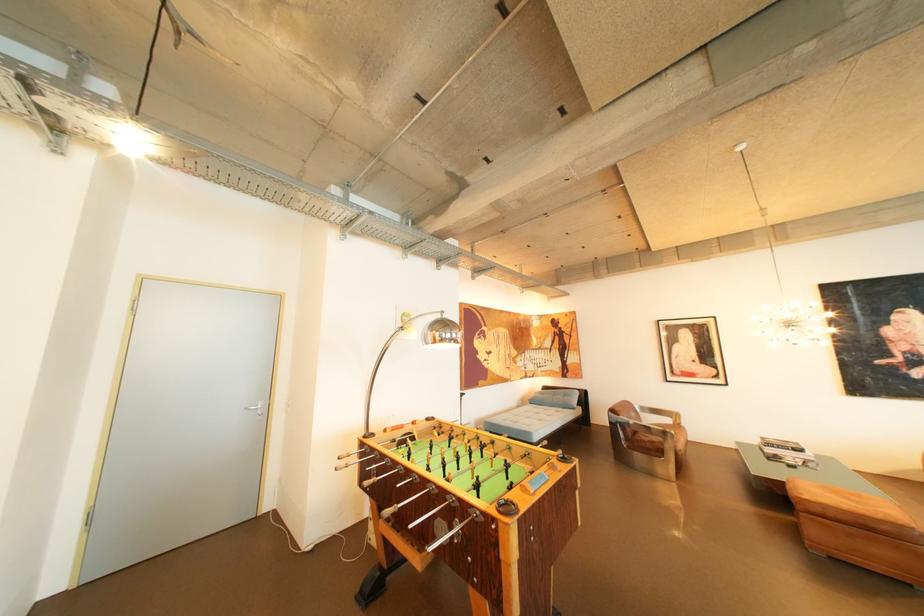
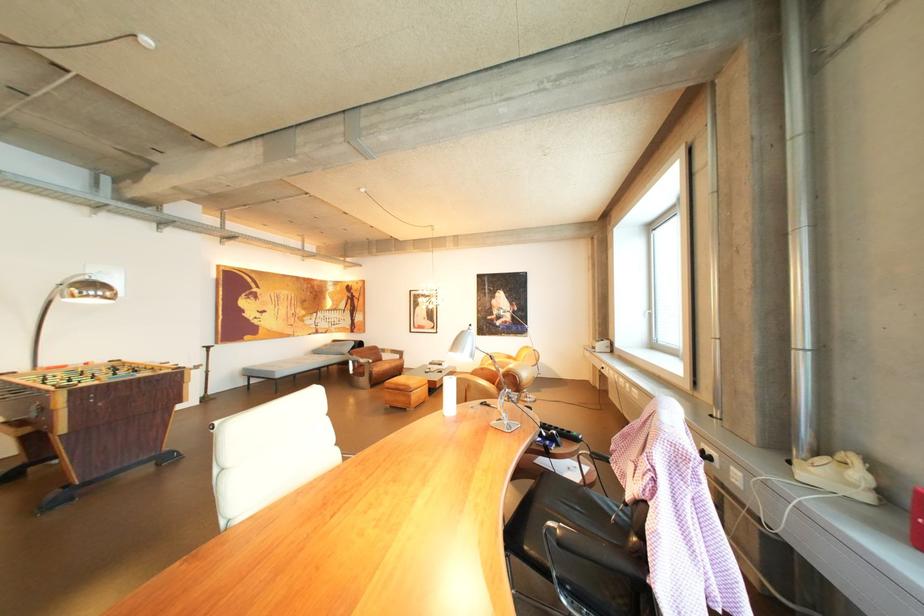
Locate, in the second image, the point that corresponds to [650,434] in the first image.

(374, 366)